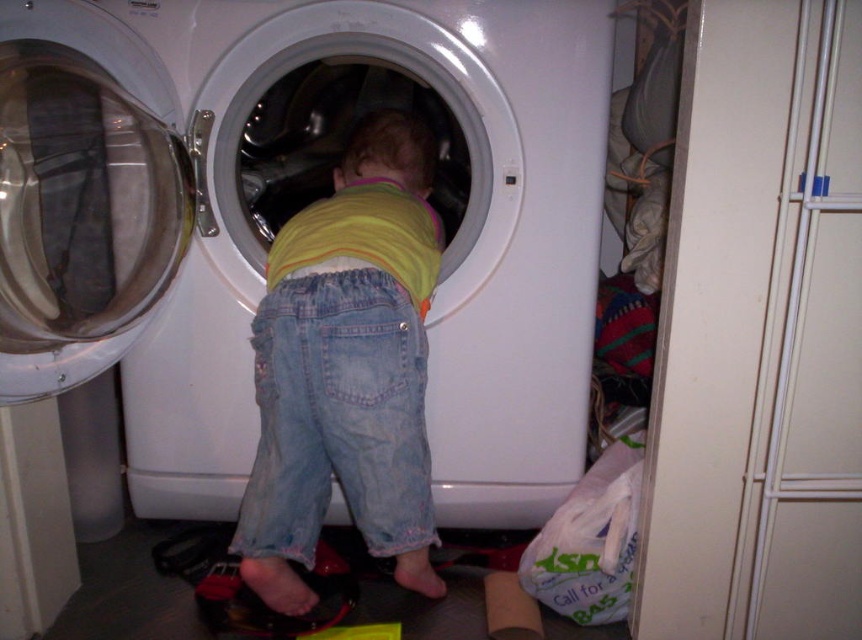
Looking at this image, is the position of white glossy washing machine at center more distant than that of denim pants at center?

No, white glossy washing machine at center is closer to the viewer.

Is white glossy washing machine at center below denim pants at center?

No.

Is point (219, 138) behind point (276, 600)?

Yes, point (219, 138) is behind point (276, 600).

Where is `white glossy washing machine at center`? white glossy washing machine at center is located at coordinates (291, 212).